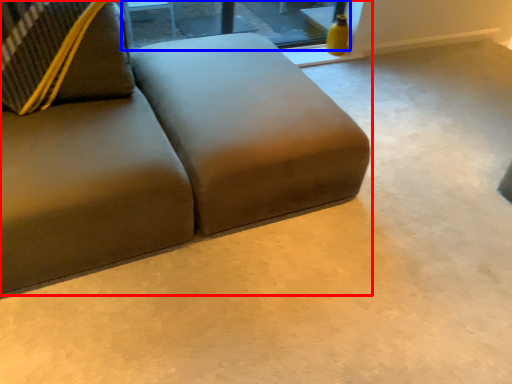
Question: Which object appears closest to the camera in this image, studio couch (highlighted by a red box) or window (highlighted by a blue box)?

Choices:
 (A) studio couch
 (B) window

Answer: (A)